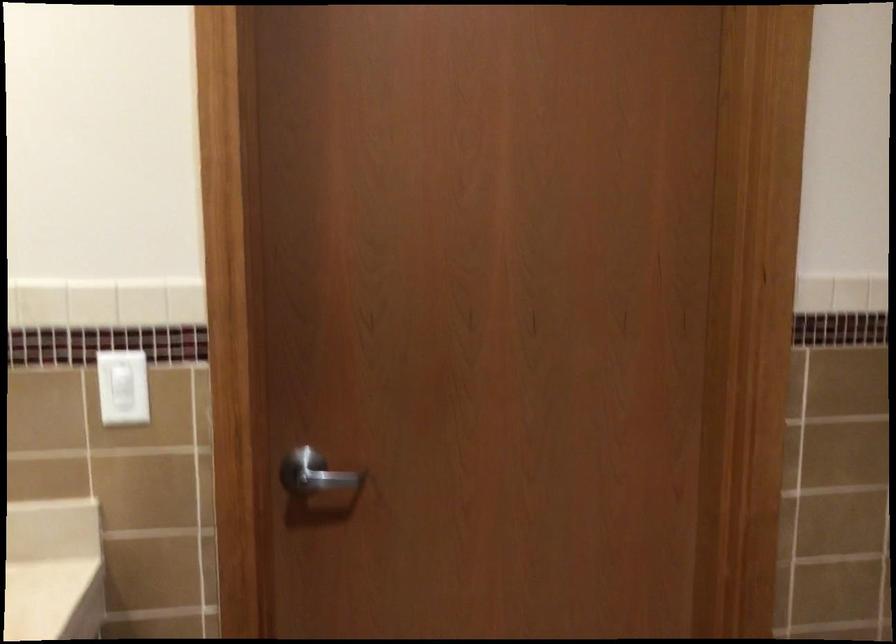
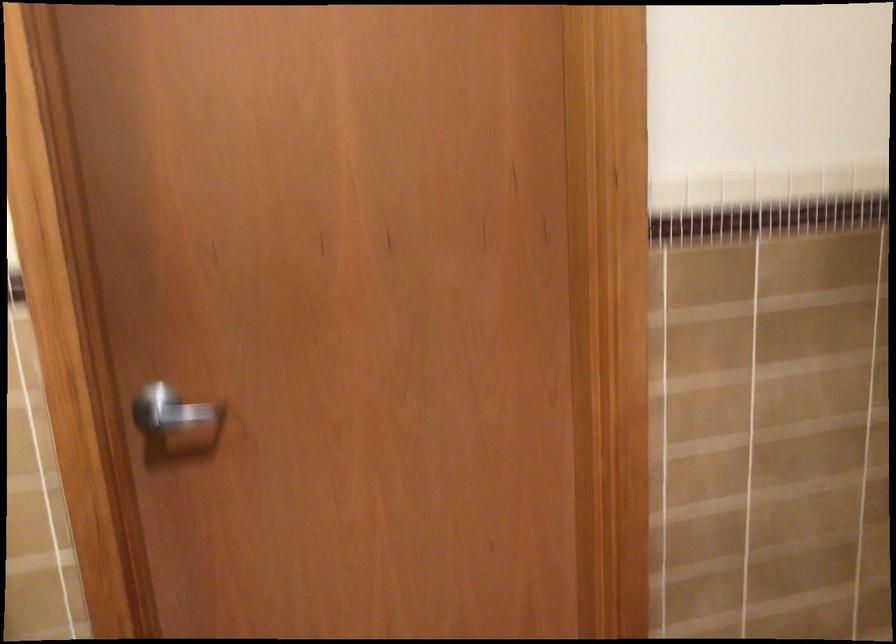
Question: The first image is from the beginning of the video and the second image is from the end. How did the camera likely rotate when shooting the video?

Choices:
 (A) Left
 (B) Right
 (C) Up
 (D) Down

Answer: (D)